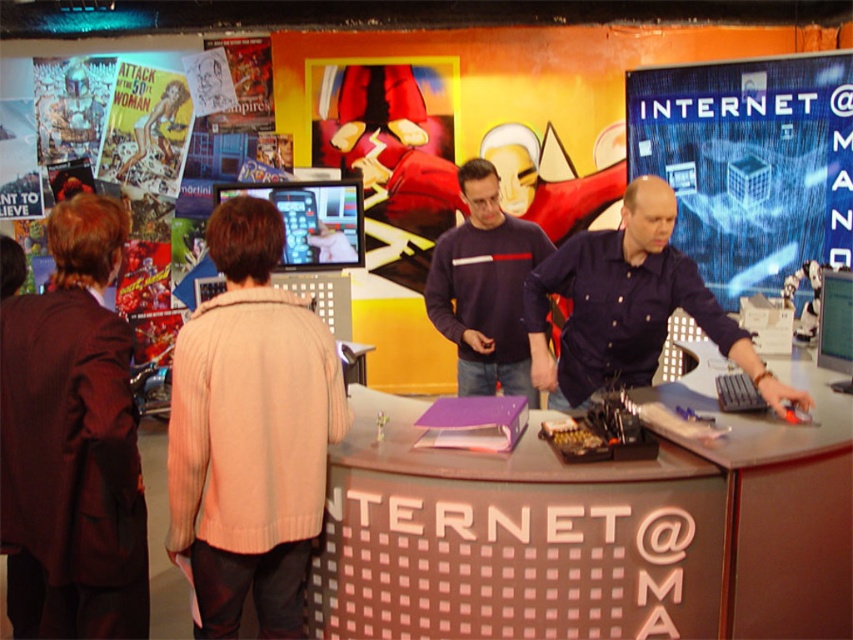
You are a customer at the internet cafe and want to pay for your session. You see the blue digital screen at right and the black plastic register at center. Which object should you approach to complete the payment?

The black plastic register at center is the correct location for payment since it is a register typically used for transactions, while the blue digital screen at right is likely for internet access.

You are a customer in the internet cafe and you want to place your beige knitted sweater at center on the counter. The counter is 6 feet long. Can you place the sweater on the counter without it hanging off the edge?

The beige knitted sweater at center is 6.08 feet apart from the counter. Since the counter is only 6 feet long, the sweater will hang off the edge by 0.08 feet.

Looking at this image, you are a customer at the internet cafe and need to pay the bill. You see the beige knitted sweater at center and the black plastic register at center. Which object should you approach to pay?

The black plastic register at center is the correct place to pay, as it is typically used for transactions. The beige knitted sweater at center is likely an item left by someone else and not related to payment.